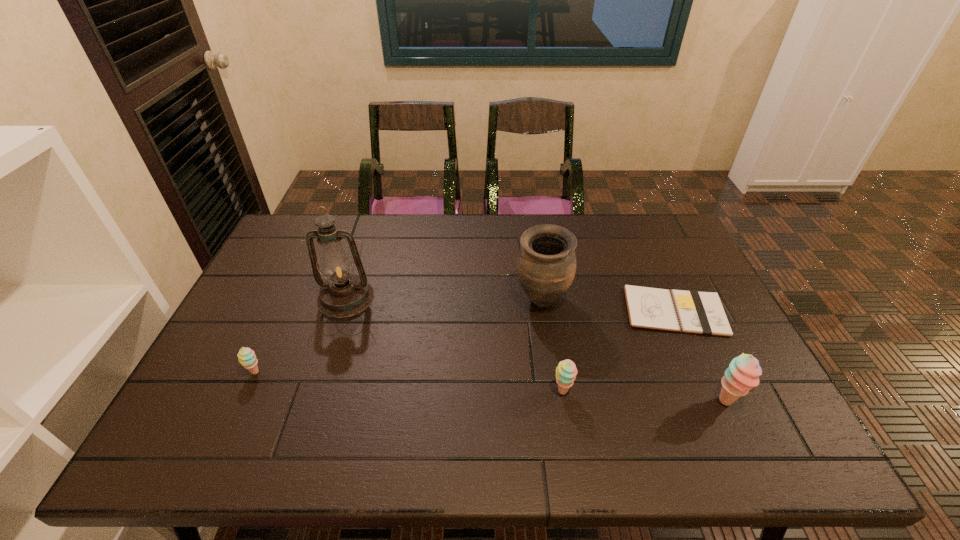
Identify the location of blank space at the far edge. (584, 253).

Where is `free space at the near edge of the desktop`? This screenshot has height=540, width=960. free space at the near edge of the desktop is located at coordinates (318, 400).

Locate an element on the screen. Image resolution: width=960 pixels, height=540 pixels. free space at the left edge is located at coordinates click(x=240, y=318).

The image size is (960, 540). In the image, there is a desktop. Find the location of `vacant space at the right edge`. vacant space at the right edge is located at coordinates (710, 339).

In the image, there is a desktop. What are the coordinates of `free space at the far left corner` in the screenshot? It's located at (303, 214).

Locate an element on the screen. vacant space at the far right corner is located at coordinates (682, 242).

This screenshot has height=540, width=960. In the image, there is a desktop. Identify the location of free space at the near right corner. (783, 416).

Find the location of a particular element. The height and width of the screenshot is (540, 960). vacant space that is in between the third tallest object and the third shortest object is located at coordinates (644, 396).

This screenshot has width=960, height=540. I want to click on free spot between the tallest object and the third tallest object, so click(536, 350).

Find the location of a particular element. empty space between the tallest sherbert and the shortest sherbert is located at coordinates (491, 387).